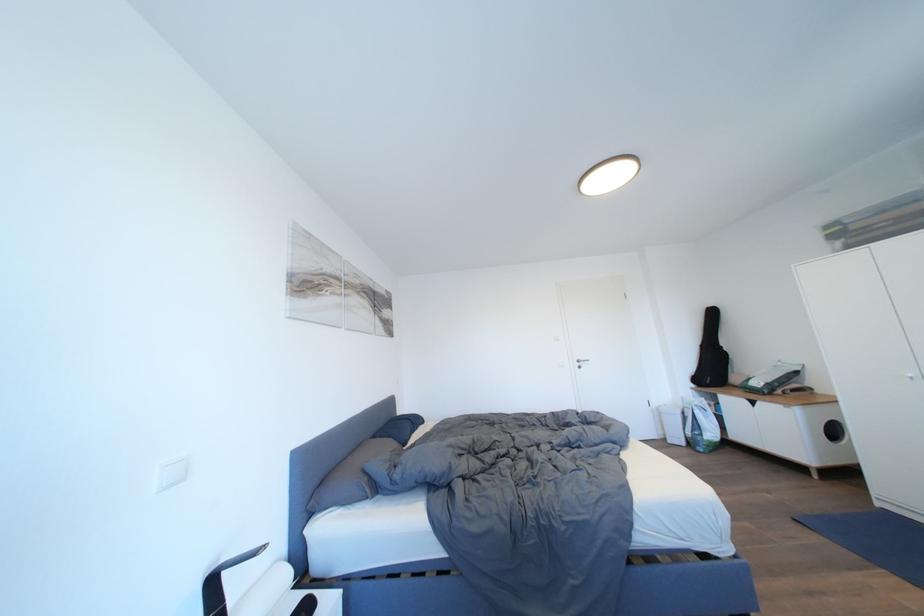
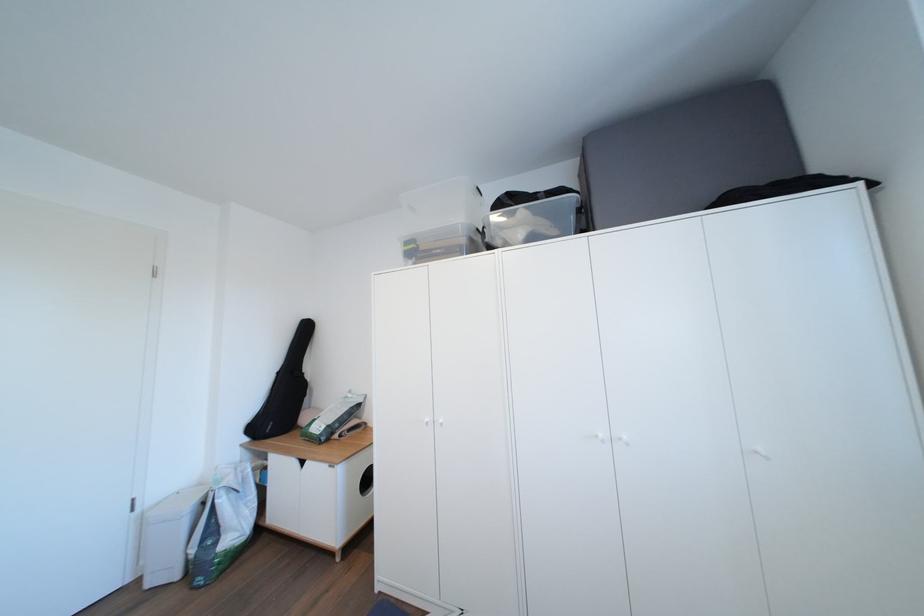
Find the pixel in the second image that matches pixel 720 378 in the first image.

(289, 416)